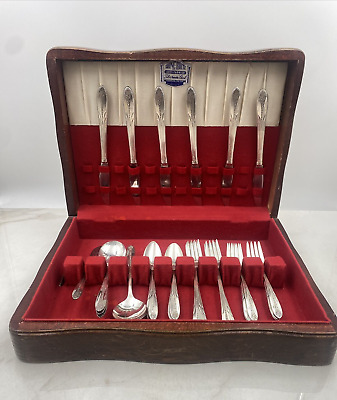
Identify the location of forks. (253, 251), (237, 251), (207, 246), (193, 250).